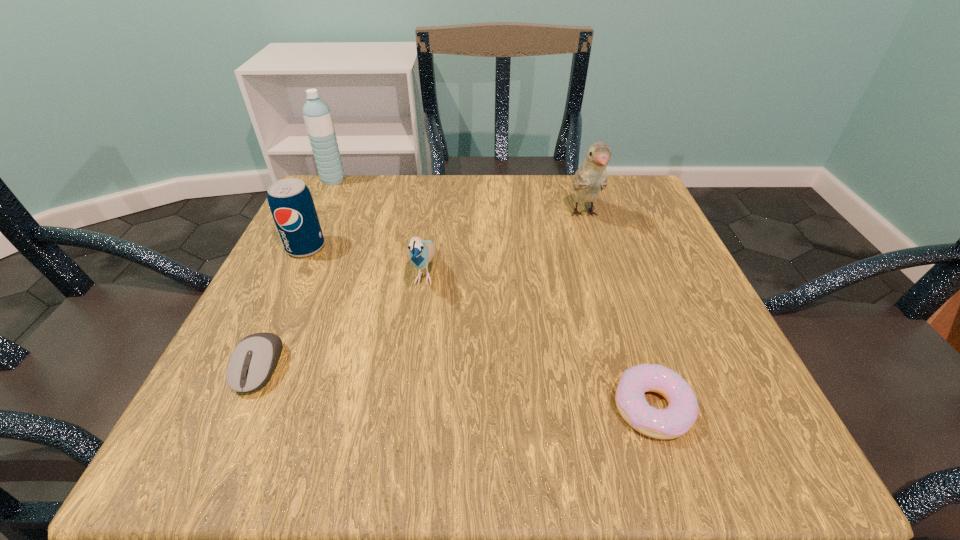
You are a GUI agent. You are given a task and a screenshot of the screen. Output one action in this format:
    pyautogui.click(x=<x>, y=<y>)
    Task: Click on the computer equipment that is at the left edge
    
    Given the screenshot: What is the action you would take?
    pyautogui.click(x=252, y=363)

This screenshot has width=960, height=540. Identify the location of bird that is at the right edge. (591, 177).

Identify the location of doughnut positioned at the right edge. (675, 420).

Image resolution: width=960 pixels, height=540 pixels. Identify the location of object located in the far left corner section of the desktop. (317, 115).

In order to click on object at the far right corner in this screenshot , I will do `click(591, 177)`.

Where is `object at the near right corner`? object at the near right corner is located at coordinates (675, 420).

In the image, there is a desktop. Identify the location of free space at the far edge. This screenshot has width=960, height=540. (434, 174).

I want to click on free space at the near edge of the desktop, so click(352, 463).

Where is `free space at the left edge of the desktop`? free space at the left edge of the desktop is located at coordinates click(226, 394).

In the image, there is a desktop. Identify the location of blank space at the right edge. [x=724, y=346].